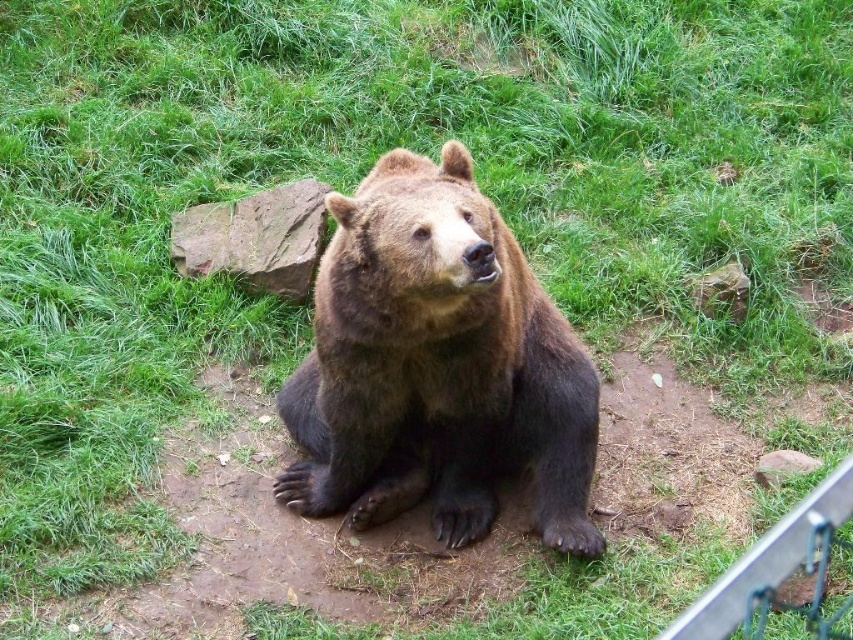
Question: Does brown furry bear at center lie behind brown rough rock at center-right?

Choices:
 (A) yes
 (B) no

Answer: (B)

Question: Can you confirm if brown furry bear at center is wider than brown rock at center?

Choices:
 (A) yes
 (B) no

Answer: (A)

Question: Which object appears closest to the camera in this image?

Choices:
 (A) brown rock at center
 (B) brown furry bear at center

Answer: (B)

Question: Which point appears closest to the camera in this image?

Choices:
 (A) (737, 289)
 (B) (560, 493)

Answer: (B)

Question: Is brown furry bear at center closer to camera compared to brown rock at center?

Choices:
 (A) no
 (B) yes

Answer: (B)

Question: Which object appears closest to the camera in this image?

Choices:
 (A) brown rock at center
 (B) brown rough rock at center-right

Answer: (A)